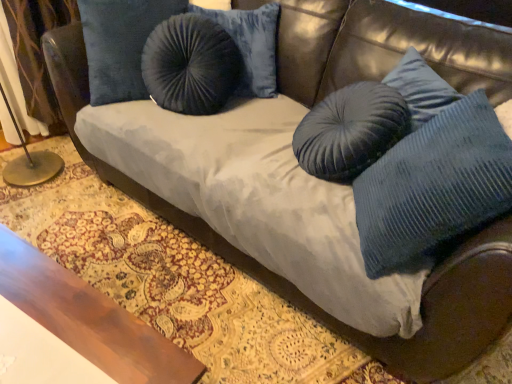
Question: Considering the relative positions of blue corduroy pillow at right and wooden table at lower left in the image provided, is blue corduroy pillow at right to the left or to the right of wooden table at lower left?

Choices:
 (A) right
 (B) left

Answer: (A)

Question: Looking at their shapes, would you say blue corduroy pillow at right is wider or thinner than wooden table at lower left?

Choices:
 (A) thin
 (B) wide

Answer: (A)

Question: Which is nearer to the wooden table at lower left?

Choices:
 (A) velvet curtain at left
 (B) blue corduroy pillow at right

Answer: (B)

Question: Estimate the real-world distances between objects in this image. Which object is farther from the blue corduroy pillow at right?

Choices:
 (A) wooden table at lower left
 (B) velvet curtain at left

Answer: (B)